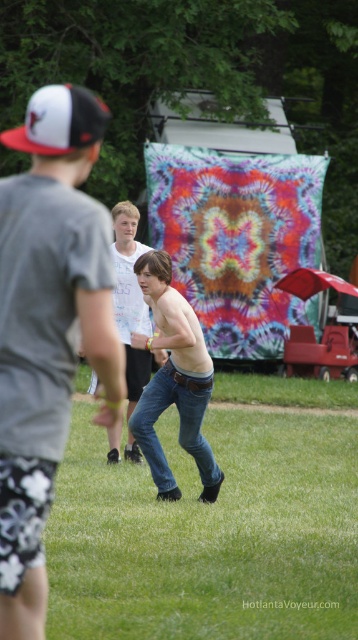
Question: Which object is the closest to the green grass at center?

Choices:
 (A) shiny silver belt at center
 (B) white mesh baseball cap at upper left

Answer: (B)

Question: Can you confirm if green grass at center is bigger than white mesh baseball cap at upper left?

Choices:
 (A) yes
 (B) no

Answer: (B)

Question: Can you confirm if green grass at center is positioned below shiny silver belt at center?

Choices:
 (A) no
 (B) yes

Answer: (B)

Question: Which is farther from the denim jeans at center?

Choices:
 (A) shiny silver belt at center
 (B) jeans at center

Answer: (A)

Question: Which of the following is the farthest from the observer?

Choices:
 (A) (202, 490)
 (B) (75, 115)

Answer: (A)

Question: Does green grass at center have a lesser width compared to shiny silver belt at center?

Choices:
 (A) no
 (B) yes

Answer: (A)